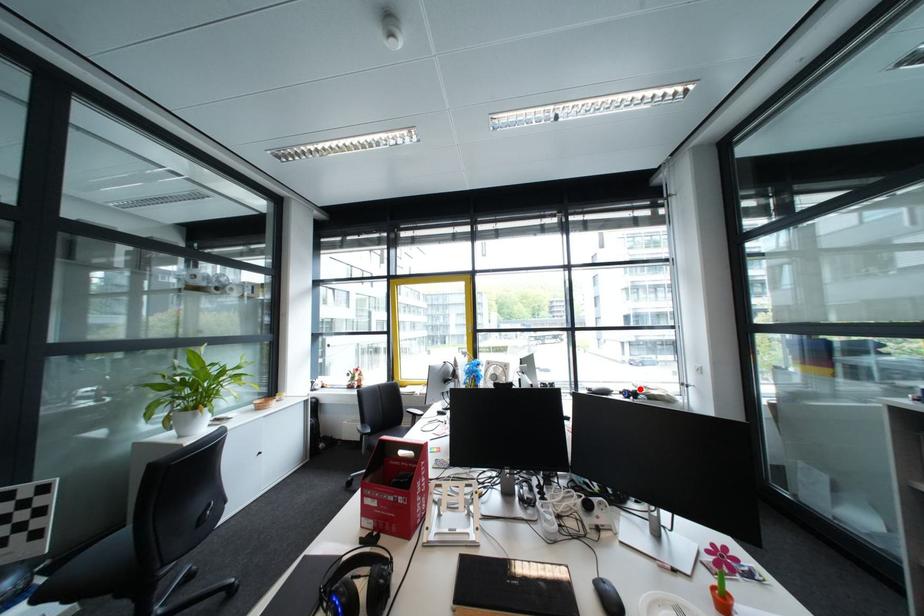
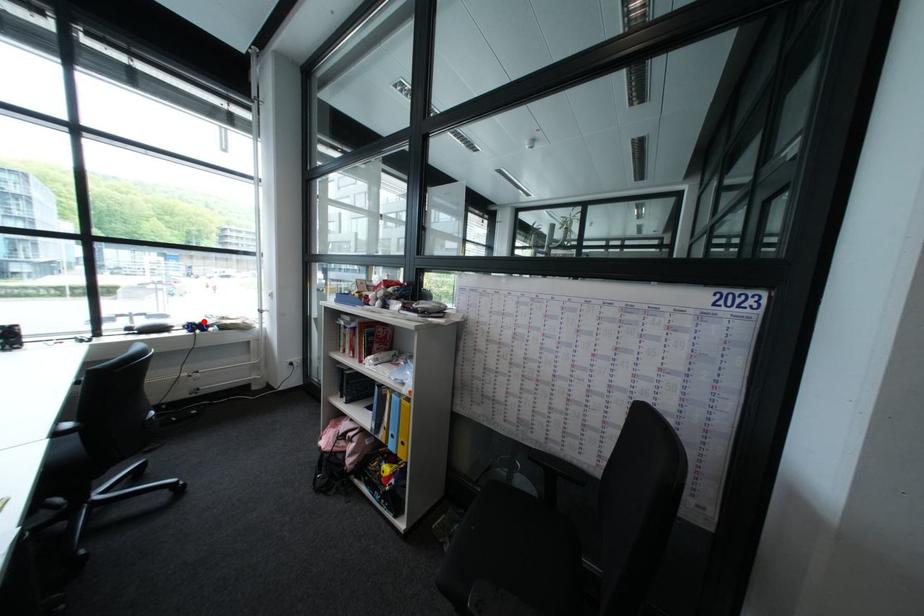
I am providing you with two images of the same scene from different viewpoints. A red point is marked on the first image and another point is marked on the second image. Does the point marked in image1 correspond to the same location as the one in image2?

Yes